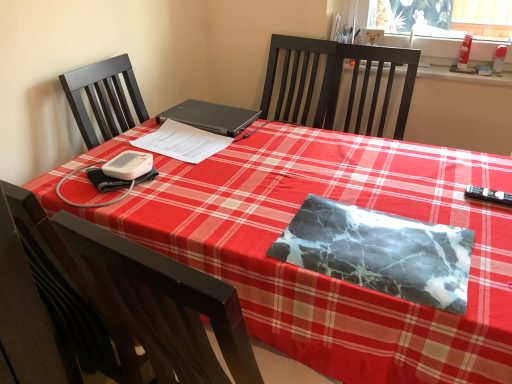
Question: From a real-world perspective, is black matte laptop at center positioned under black plastic remote control at right based on gravity?

Choices:
 (A) no
 (B) yes

Answer: (A)

Question: Can you confirm if black matte laptop at center is positioned to the right of black plastic remote control at right?

Choices:
 (A) yes
 (B) no

Answer: (B)

Question: Can you confirm if black matte laptop at center is positioned to the left of black plastic remote control at right?

Choices:
 (A) yes
 (B) no

Answer: (A)

Question: Is black matte laptop at center bigger than black plastic remote control at right?

Choices:
 (A) no
 (B) yes

Answer: (B)

Question: Considering the relative sizes of black matte laptop at center and black plastic remote control at right in the image provided, is black matte laptop at center wider than black plastic remote control at right?

Choices:
 (A) yes
 (B) no

Answer: (A)

Question: Does black matte laptop at center have a greater height compared to black plastic remote control at right?

Choices:
 (A) yes
 (B) no

Answer: (A)

Question: From a real-world perspective, does black plastic remote control at right sit lower than marble-patterned notebook at center, marked as the second notebook in a left-to-right arrangement?

Choices:
 (A) yes
 (B) no

Answer: (A)

Question: From a real-world perspective, is black plastic remote control at right on marble-patterned notebook at center, the first notebook when ordered from front to back?

Choices:
 (A) yes
 (B) no

Answer: (B)

Question: Could marble-patterned notebook at center, the first notebook when ordered from front to back, be considered to be inside black plastic remote control at right?

Choices:
 (A) yes
 (B) no

Answer: (B)

Question: Are black plastic remote control at right and marble-patterned notebook at center, marked as the second notebook in a left-to-right arrangement, beside each other?

Choices:
 (A) no
 (B) yes

Answer: (A)

Question: Does black plastic remote control at right appear on the right side of marble-patterned notebook at center, the first notebook when ordered from front to back?

Choices:
 (A) no
 (B) yes

Answer: (B)

Question: Considering the relative sizes of black plastic remote control at right and marble-patterned notebook at center, placed as the 1th notebook when sorted from right to left, in the image provided, is black plastic remote control at right thinner than marble-patterned notebook at center, placed as the 1th notebook when sorted from right to left,?

Choices:
 (A) no
 (B) yes

Answer: (B)

Question: From a real-world perspective, is black plastic remote control at right positioned over black matte laptop at center based on gravity?

Choices:
 (A) no
 (B) yes

Answer: (A)